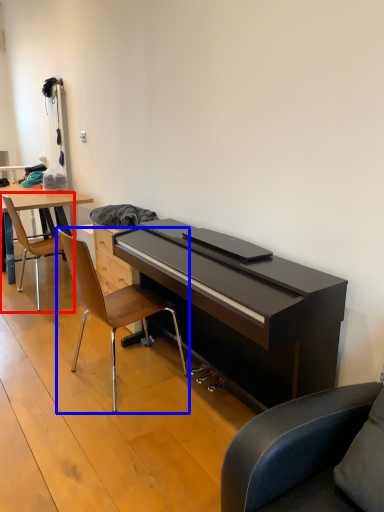
Question: Among these objects, which one is farthest to the camera, chair (highlighted by a red box) or chair (highlighted by a blue box)?

Choices:
 (A) chair
 (B) chair

Answer: (A)